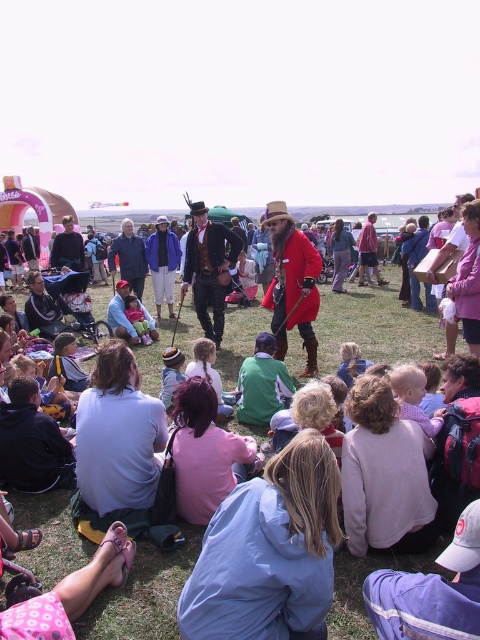
Between blue fabric jacket at lower center and white cotton shirt at lower left, which one appears on the right side from the viewer's perspective?

blue fabric jacket at lower center is more to the right.

Locate an element on the screen. This screenshot has width=480, height=640. blue fabric jacket at lower center is located at coordinates (268, 552).

Can you confirm if red velvet coat at center is thinner than white cotton shirt at lower left?

Incorrect, red velvet coat at center's width is not less than white cotton shirt at lower left's.

Does red velvet coat at center have a lesser height compared to white cotton shirt at lower left?

No, red velvet coat at center is not shorter than white cotton shirt at lower left.

Does point (328, 541) come behind point (120, 371)?

No, (328, 541) is in front of (120, 371).

At what (x,y) coordinates should I click in order to perform the action: click on red velvet coat at center. Please return your answer as a coordinate pair (x, y). The width and height of the screenshot is (480, 640). Looking at the image, I should click on (248, 557).

Can you confirm if red velvet coat at center is shorter than blue fabric jacket at lower center?

In fact, red velvet coat at center may be taller than blue fabric jacket at lower center.

Who is shorter, red velvet coat at center or blue fabric jacket at lower center?

blue fabric jacket at lower center

In order to click on red velvet coat at center in this screenshot , I will do `click(248, 557)`.